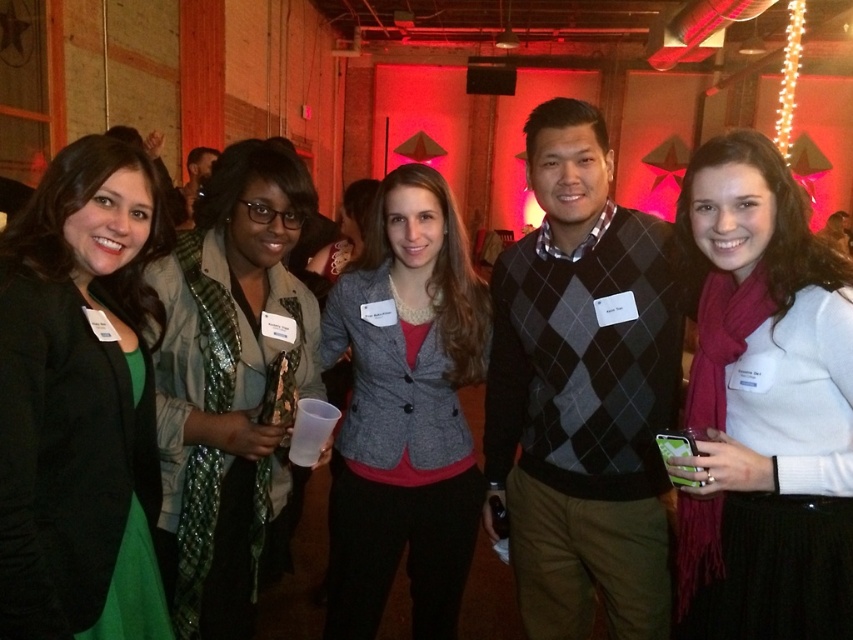
Question: Based on their relative distances, which object is farther from the gray wool blazer at center?

Choices:
 (A) green matte blazer at left
 (B) green textured scarf at left
 (C) white sweater at center
 (D) argyle sweater at center

Answer: (C)

Question: Can you confirm if white sweater at center is positioned to the left of green textured scarf at left?

Choices:
 (A) yes
 (B) no

Answer: (B)

Question: Which object appears farthest from the camera in this image?

Choices:
 (A) argyle sweater at center
 (B) green matte blazer at left
 (C) white sweater at center

Answer: (A)

Question: Does argyle sweater at center have a greater width compared to white sweater at center?

Choices:
 (A) yes
 (B) no

Answer: (A)

Question: Where is green textured scarf at left located in relation to gray wool blazer at center in the image?

Choices:
 (A) above
 (B) below

Answer: (A)

Question: Which is nearer to the white sweater at center?

Choices:
 (A) argyle sweater at center
 (B) green matte blazer at left

Answer: (A)